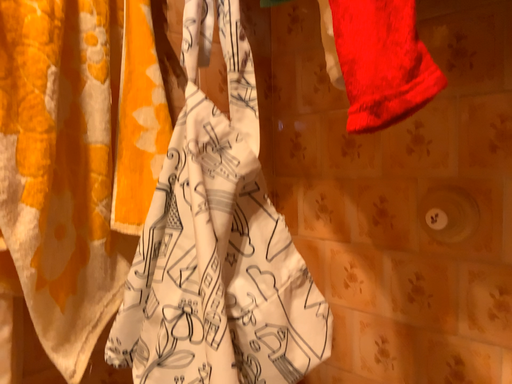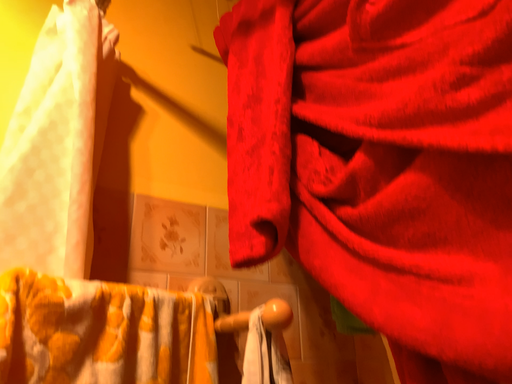
Question: How did the camera likely rotate when shooting the video?

Choices:
 (A) rotated left
 (B) rotated right

Answer: (A)